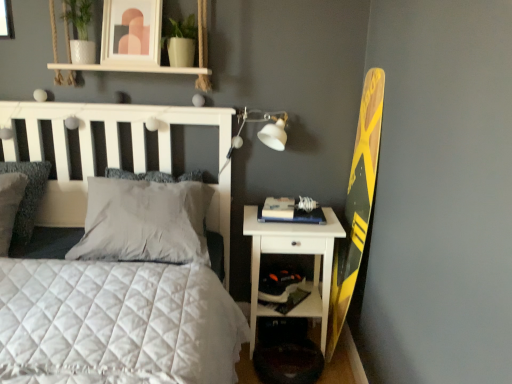
This screenshot has width=512, height=384. What do you see at coordinates (143, 222) in the screenshot? I see `white soft pillow at center, the 3th pillow in the left-to-right sequence` at bounding box center [143, 222].

This screenshot has height=384, width=512. Find the location of `white soft pillow at center, positioned as the first pillow in right-to-left order`. white soft pillow at center, positioned as the first pillow in right-to-left order is located at coordinates (143, 222).

Measure the distance between point (25,167) and camera.

Point (25,167) is 2.10 meters away from camera.

Locate an element on the screen. Image resolution: width=512 pixels, height=384 pixels. hardcover book at right is located at coordinates (291, 211).

Measure the distance between white wood nightstand at lower right and camera.

The distance of white wood nightstand at lower right from camera is 1.95 meters.

The image size is (512, 384). Describe the element at coordinates (294, 253) in the screenshot. I see `white wood nightstand at lower right` at that location.

Measure the distance between point (x=160, y=354) and camera.

The depth of point (x=160, y=354) is 1.17 meters.

Where is `gray soft pillow at center, marked as the second pillow in a right-to-left arrangement`? The height and width of the screenshot is (384, 512). gray soft pillow at center, marked as the second pillow in a right-to-left arrangement is located at coordinates (139, 175).

In the scene shown: From a real-world perspective, between textured gray pillow at left, placed as the 1th pillow when sorted from left to right, and white matte table lamp at upper right, who is vertically higher?

→ From a 3D spatial view, white matte table lamp at upper right is above.

Is textured gray pillow at left, marked as the 3th pillow in a right-to-left arrangement, facing towards white matte table lamp at upper right?

No, textured gray pillow at left, marked as the 3th pillow in a right-to-left arrangement, is not aimed at white matte table lamp at upper right.

Measure the distance between textured gray pillow at left, marked as the 3th pillow in a right-to-left arrangement, and white matte table lamp at upper right.

textured gray pillow at left, marked as the 3th pillow in a right-to-left arrangement, and white matte table lamp at upper right are 1.04 meters apart.

Is textured gray pillow at left, marked as the 3th pillow in a right-to-left arrangement, outside of white plastic shelf at lower right?

Yes, textured gray pillow at left, marked as the 3th pillow in a right-to-left arrangement, is outside of white plastic shelf at lower right.

Is textured gray pillow at left, placed as the 1th pillow when sorted from left to right, beside white plastic shelf at lower right?

No, textured gray pillow at left, placed as the 1th pillow when sorted from left to right, is not next to white plastic shelf at lower right.

Considering the sizes of textured gray pillow at left, marked as the 3th pillow in a right-to-left arrangement, and white plastic shelf at lower right in the image, is textured gray pillow at left, marked as the 3th pillow in a right-to-left arrangement, wider or thinner than white plastic shelf at lower right?

Clearly, textured gray pillow at left, marked as the 3th pillow in a right-to-left arrangement, has more width compared to white plastic shelf at lower right.

From a real-world perspective, is textured gray pillow at left, placed as the 1th pillow when sorted from left to right, located higher than white plastic shelf at lower right?

Correct, in the physical world, textured gray pillow at left, placed as the 1th pillow when sorted from left to right, is higher than white plastic shelf at lower right.

Based on the photo, which object is thinner, white wood nightstand at lower right or gray soft pillow at center, marked as the second pillow in a right-to-left arrangement?

Thinner between the two is gray soft pillow at center, marked as the second pillow in a right-to-left arrangement.

Consider the image. Can gray soft pillow at center, marked as the second pillow in a right-to-left arrangement, be found inside white wood nightstand at lower right?

No, white wood nightstand at lower right does not contain gray soft pillow at center, marked as the second pillow in a right-to-left arrangement.

From a real-world perspective, between white wood nightstand at lower right and gray soft pillow at center, which is the 2th pillow in left-to-right order, who is vertically lower?

From a 3D spatial view, white wood nightstand at lower right is below.

Does white matte table lamp at upper right contain white wood nightstand at lower right?

Actually, white wood nightstand at lower right is outside white matte table lamp at upper right.

Is the depth of white matte table lamp at upper right greater than that of white wood nightstand at lower right?

Yes, white matte table lamp at upper right is behind white wood nightstand at lower right.

Considering the positions of point (274, 114) and point (263, 232), is point (274, 114) closer or farther from the camera than point (263, 232)?

Clearly, point (274, 114) is more distant from the camera than point (263, 232).

Measure the distance between white matte table lamp at upper right and white wood nightstand at lower right.

The distance of white matte table lamp at upper right from white wood nightstand at lower right is 52.77 centimeters.

In the image, is gray soft pillow at center, marked as the second pillow in a right-to-left arrangement, positioned in front of or behind white wood nightstand at lower right?

In the image, gray soft pillow at center, marked as the second pillow in a right-to-left arrangement, appears in front of white wood nightstand at lower right.

From a real-world perspective, is gray soft pillow at center, which is the 2th pillow in left-to-right order, over white wood nightstand at lower right?

Yes, from a real-world perspective, gray soft pillow at center, which is the 2th pillow in left-to-right order, is on top of white wood nightstand at lower right.

Is gray soft pillow at center, marked as the second pillow in a right-to-left arrangement, directly adjacent to white wood nightstand at lower right?

No, gray soft pillow at center, marked as the second pillow in a right-to-left arrangement, is not with white wood nightstand at lower right.

Does point (327, 243) lie behind point (110, 5)?

Yes.

Is matte white picture frame at upper center surrounded by white wood nightstand at lower right?

No, white wood nightstand at lower right does not contain matte white picture frame at upper center.

Does white wood nightstand at lower right turn towards matte white picture frame at upper center?

No, white wood nightstand at lower right does not turn towards matte white picture frame at upper center.

Can you tell me how much white wood nightstand at lower right and matte white picture frame at upper center differ in facing direction?

white wood nightstand at lower right and matte white picture frame at upper center are facing 0.796 degrees away from each other.

From a real-world perspective, is white soft pillow at center, positioned as the first pillow in right-to-left order, located beneath gray soft pillow at center, which is the 2th pillow in left-to-right order?

Yes, from a real-world perspective, white soft pillow at center, positioned as the first pillow in right-to-left order, is beneath gray soft pillow at center, which is the 2th pillow in left-to-right order.

Is white soft pillow at center, positioned as the first pillow in right-to-left order, not inside gray soft pillow at center, which is the 2th pillow in left-to-right order?

No, white soft pillow at center, positioned as the first pillow in right-to-left order, is inside gray soft pillow at center, which is the 2th pillow in left-to-right order,'s boundary.

Is white soft pillow at center, positioned as the first pillow in right-to-left order, positioned far away from gray soft pillow at center, marked as the second pillow in a right-to-left arrangement?

white soft pillow at center, positioned as the first pillow in right-to-left order, is near gray soft pillow at center, marked as the second pillow in a right-to-left arrangement, not far away.

Considering the sizes of objects white soft pillow at center, the 3th pillow in the left-to-right sequence, and gray soft pillow at center, marked as the second pillow in a right-to-left arrangement, in the image provided, who is wider, white soft pillow at center, the 3th pillow in the left-to-right sequence, or gray soft pillow at center, marked as the second pillow in a right-to-left arrangement,?

white soft pillow at center, the 3th pillow in the left-to-right sequence, is wider.

Locate an element on the screen. The image size is (512, 384). pillow that is the 2nd one when counting forward from the white matte table lamp at upper right is located at coordinates (27, 199).

At what (x,y) coordinates should I click in order to perform the action: click on shelf lying behind the textured gray pillow at left, placed as the 1th pillow when sorted from left to right. Please return your answer as a coordinate pair (x, y). Looking at the image, I should click on (302, 300).

Based on the photo, when comparing their distances from white plastic shelf at lower right, does hardcover book at right or matte white picture frame at upper center seem closer?

hardcover book at right lies closer to white plastic shelf at lower right than the other object.

Based on their spatial positions, is matte white picture frame at upper center or hardcover book at right closer to textured gray pillow at left, marked as the 3th pillow in a right-to-left arrangement?

Among the two, matte white picture frame at upper center is located nearer to textured gray pillow at left, marked as the 3th pillow in a right-to-left arrangement.

Based on their spatial positions, is matte white picture frame at upper center or white quilted bed at center further from hardcover book at right?

matte white picture frame at upper center is positioned further to the anchor hardcover book at right.

Looking at the image, which one is located closer to white wood nightstand at lower right, hardcover book at right or white plastic shelf at lower right?

white plastic shelf at lower right is closer to white wood nightstand at lower right.

Based on their spatial positions, is gray soft pillow at center, marked as the second pillow in a right-to-left arrangement, or white plastic shelf at lower right further from textured gray pillow at left, marked as the 3th pillow in a right-to-left arrangement?

white plastic shelf at lower right is further to textured gray pillow at left, marked as the 3th pillow in a right-to-left arrangement.

Based on their spatial positions, is white quilted bed at center or hardcover book at right further from white wood nightstand at lower right?

white quilted bed at center.

Estimate the real-world distances between objects in this image. Which object is closer to hardcover book at right, textured gray pillow at left, marked as the 3th pillow in a right-to-left arrangement, or white quilted bed at center?

white quilted bed at center is positioned closer to the anchor hardcover book at right.

Estimate the real-world distances between objects in this image. Which object is further from white plastic shelf at lower right, matte white picture frame at upper center or white soft pillow at center, positioned as the first pillow in right-to-left order?

matte white picture frame at upper center is further to white plastic shelf at lower right.

In order to click on nightstand located between white quilted bed at center and white plastic shelf at lower right in the depth direction in this screenshot , I will do tap(294, 253).

Where is `book between matte white picture frame at upper center and white plastic shelf at lower right from top to bottom`? The width and height of the screenshot is (512, 384). book between matte white picture frame at upper center and white plastic shelf at lower right from top to bottom is located at coordinates (291, 211).

The width and height of the screenshot is (512, 384). I want to click on pillow between textured gray pillow at left, marked as the 3th pillow in a right-to-left arrangement, and white soft pillow at center, the 3th pillow in the left-to-right sequence, from left to right, so pos(139,175).

What are the coordinates of `table lamp between matte white picture frame at upper center and white plastic shelf at lower right from top to bottom` in the screenshot? It's located at (264, 128).